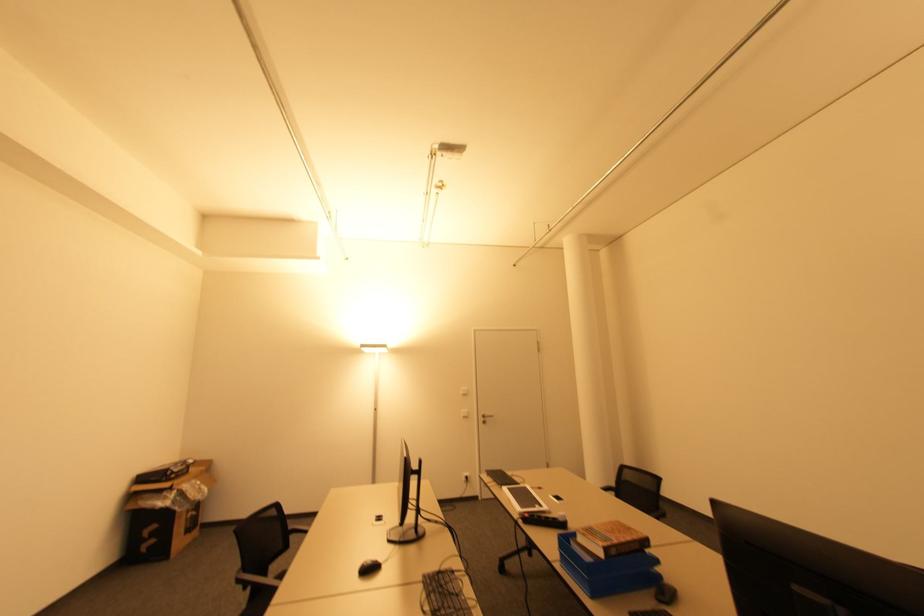
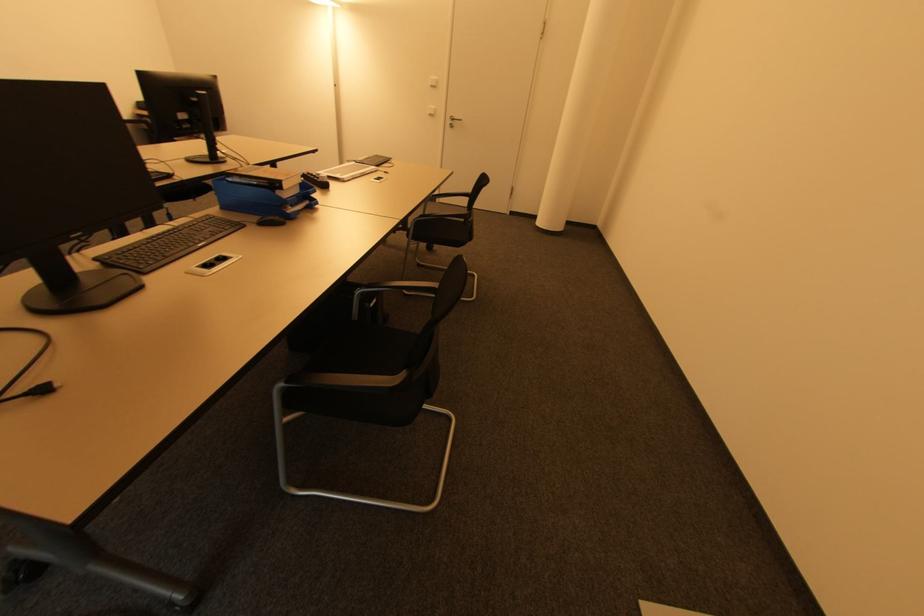
Where in the second image is the point corresponding to (466,411) from the first image?

(433, 108)